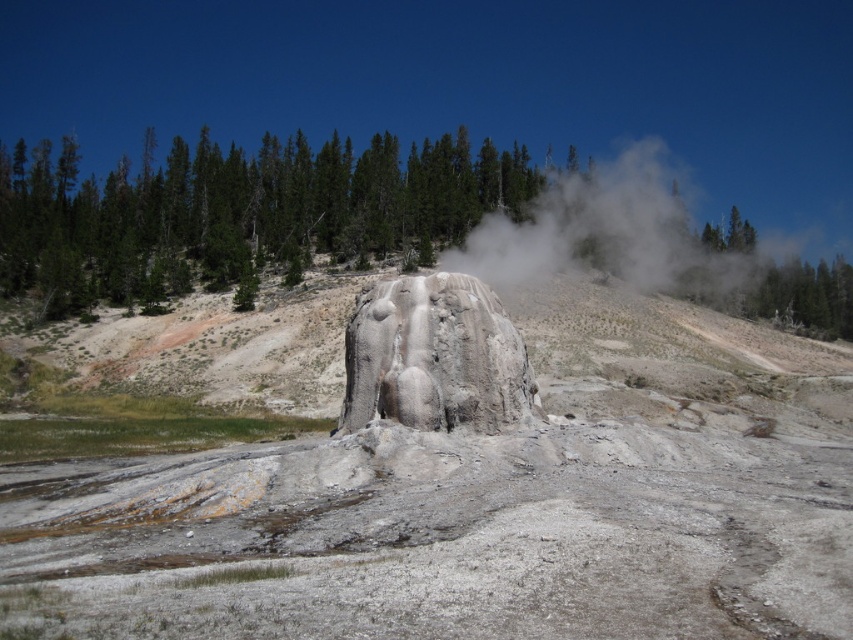
Looking at this image, you are a park ranger assessing the safety of the area. You see the green textured trees at upper center and the white vapor at center. Which object is located above the other?

The green textured trees at upper center are positioned over the white vapor at center, meaning they are above it.